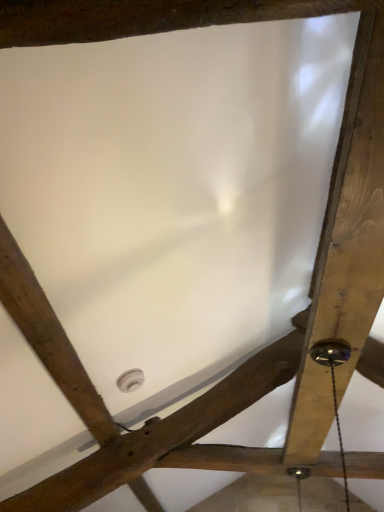
In order to face metallic glass globe at center, should I rotate leftwards or rightwards?

You should rotate right by 17.883 degrees.

What do you see at coordinates (330, 352) in the screenshot? The image size is (384, 512). I see `metallic glass globe at center` at bounding box center [330, 352].

Identify the location of metallic glass globe at center. (330, 352).

Find the location of a particular element. metallic glass globe at center is located at coordinates (330, 352).